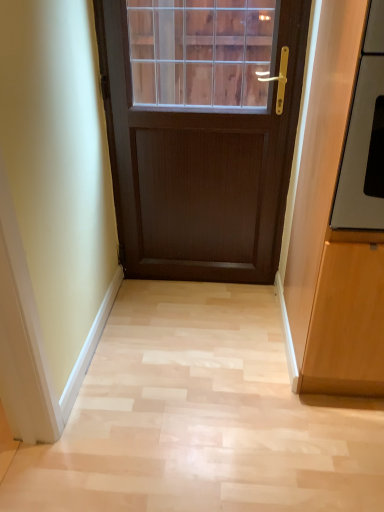
I want to click on empty space that is ontop of light wood floor at center (from a real-world perspective), so click(207, 375).